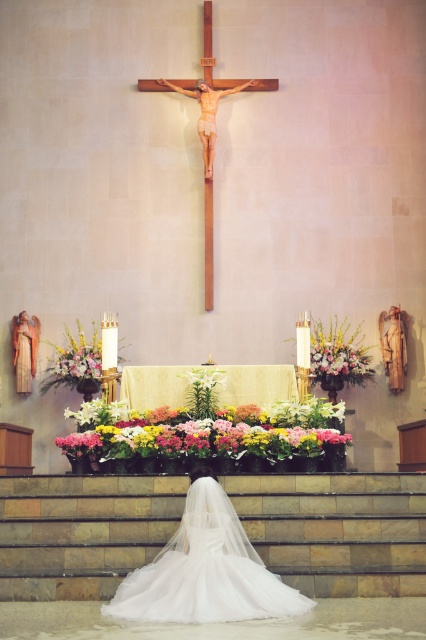
Question: Which object is farther from the camera taking this photo?

Choices:
 (A) vibrant floral bouquet at center
 (B) matte gold statue at upper center
 (C) white tulle dress at lower center

Answer: (B)

Question: Considering the relative positions of white tulle dress at lower center and vibrant floral bouquet at center in the image provided, where is white tulle dress at lower center located with respect to vibrant floral bouquet at center?

Choices:
 (A) right
 (B) left

Answer: (B)

Question: Can you confirm if white tulle dress at lower center is positioned to the left of matte gold statue at upper center?

Choices:
 (A) no
 (B) yes

Answer: (A)

Question: From the image, what is the correct spatial relationship of white tulle dress at lower center in relation to vibrant floral bouquet at center?

Choices:
 (A) above
 (B) below

Answer: (B)

Question: Which point appears farthest from the camera in this image?

Choices:
 (A) (204, 132)
 (B) (253, 548)

Answer: (A)

Question: Which point appears closest to the camera in this image?

Choices:
 (A) (339, 449)
 (B) (198, 611)

Answer: (B)